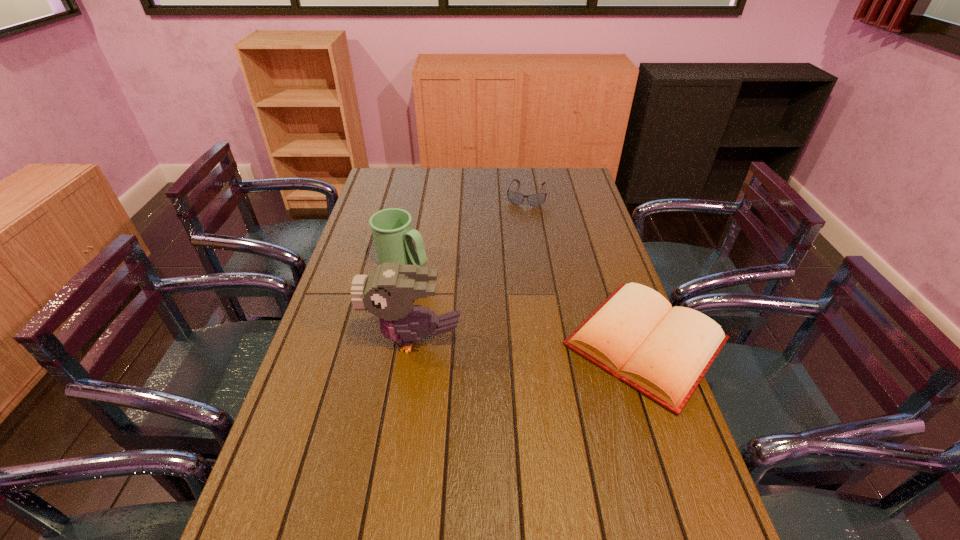
Image resolution: width=960 pixels, height=540 pixels. What are the coordinates of `the tallest object` in the screenshot? It's located at (389, 292).

You are a GUI agent. You are given a task and a screenshot of the screen. Output one action in this format:
    pyautogui.click(x=<x>, y=<y>)
    Task: Click on the Bible
    
    Given the screenshot: What is the action you would take?
    pyautogui.click(x=663, y=352)

Find the location of a particular element. This screenshot has width=960, height=540. sunglasses is located at coordinates (516, 198).

Where is `the third nearest object`? the third nearest object is located at coordinates (393, 236).

Where is `mug`? mug is located at coordinates (393, 236).

Where is `free location located at the beak of the bird`? The image size is (960, 540). free location located at the beak of the bird is located at coordinates (324, 340).

You are a GUI agent. You are given a task and a screenshot of the screen. Output one action in this format:
    pyautogui.click(x=<x>, y=<y>)
    Task: Click on the vacant space located at the beak of the bird
    This screenshot has width=960, height=540.
    Given the screenshot: What is the action you would take?
    pyautogui.click(x=317, y=340)

Find the location of a particular element. The width and height of the screenshot is (960, 540). vacant space located at the beak of the bird is located at coordinates (339, 340).

You are a GUI agent. You are given a task and a screenshot of the screen. Output one action in this format:
    pyautogui.click(x=<x>, y=<y>)
    Task: Click on the free space located 0.120m on the left of the Bible
    
    Given the screenshot: What is the action you would take?
    pyautogui.click(x=518, y=342)

Where is `vacant space positioned 0.320m on the lenses of the sunglasses`? vacant space positioned 0.320m on the lenses of the sunglasses is located at coordinates (515, 256).